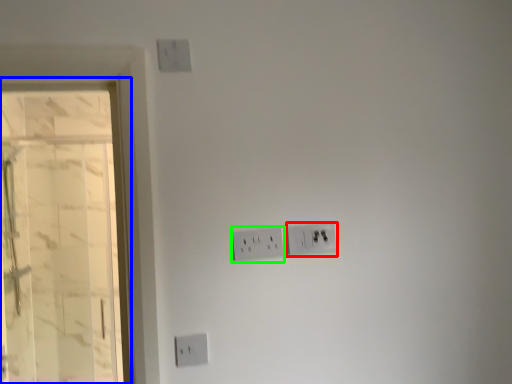
Question: Which object is the farthest from power plugs and sockets (highlighted by a red box)? Choose among these: glass door (highlighted by a blue box) or power plugs and sockets (highlighted by a green box).

Choices:
 (A) glass door
 (B) power plugs and sockets

Answer: (A)